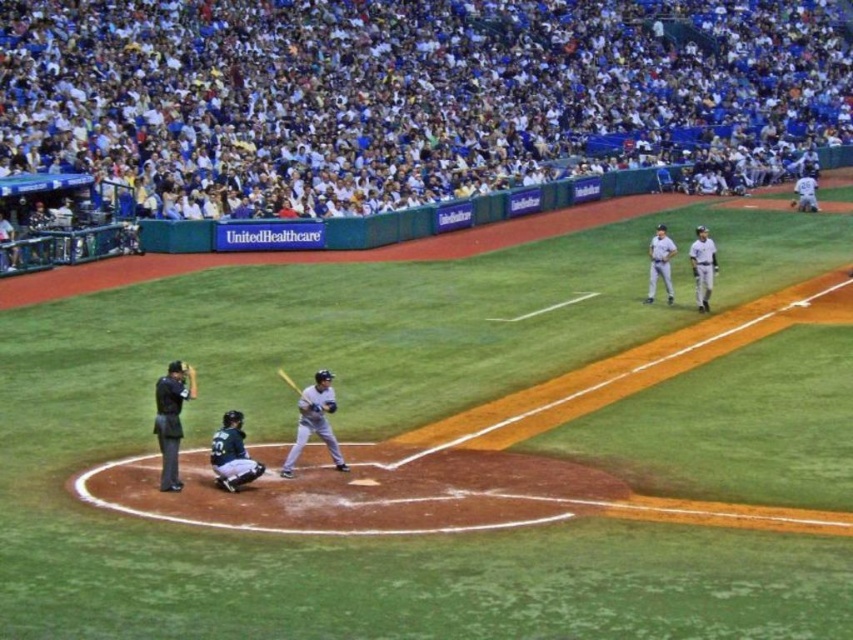
The width and height of the screenshot is (853, 640). I want to click on gray uniformed player at center, so click(379, 436).

Between point (421, 406) and point (699, 268), which one is positioned in front?

Point (421, 406) is more forward.

Where is `gray uniformed player at center`? This screenshot has height=640, width=853. gray uniformed player at center is located at coordinates (379, 436).

Does dark gray matte uniform at lower center have a lesser height compared to white uniformed player at right?

Yes, dark gray matte uniform at lower center is shorter than white uniformed player at right.

Describe the element at coordinates (231, 454) in the screenshot. The height and width of the screenshot is (640, 853). I see `dark gray matte uniform at lower center` at that location.

What do you see at coordinates (231, 454) in the screenshot? The image size is (853, 640). I see `dark gray matte uniform at lower center` at bounding box center [231, 454].

You are a GUI agent. You are given a task and a screenshot of the screen. Output one action in this format:
    pyautogui.click(x=<x>, y=<y>)
    Task: Click on the dark gray matte uniform at lower center
    Image resolution: width=853 pixels, height=640 pixels.
    Given the screenshot: What is the action you would take?
    pyautogui.click(x=231, y=454)

Who is positioned more to the left, dark gray matte uniform at lower center or white uniform at right?

Positioned to the left is dark gray matte uniform at lower center.

Is point (238, 445) behind point (704, 262)?

No, (238, 445) is closer to viewer.

The width and height of the screenshot is (853, 640). I want to click on dark gray matte uniform at lower center, so click(231, 454).